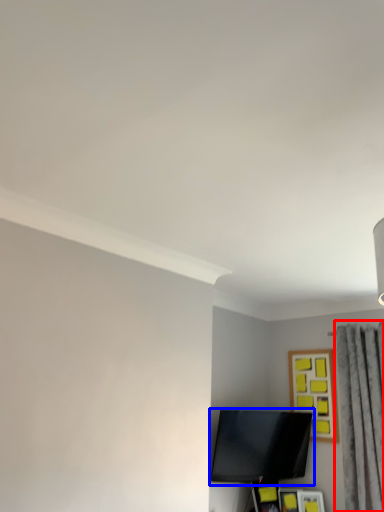
Question: Which of the following is the farthest to the observer, curtain (highlighted by a red box) or television (highlighted by a blue box)?

Choices:
 (A) curtain
 (B) television

Answer: (B)